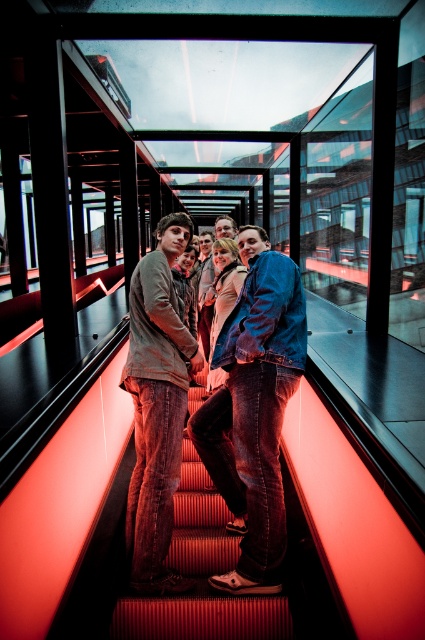
You are standing on the red steps of the escalator in the modern building with glass walls. You notice a point marked at coordinates (x=156, y=404). What object is located at that point?

The point at coordinates (x=156, y=404) has a matte gray hoodie at center.

You are a photographer trying to capture a detailed shot of the denim jacket at center and the smooth red carpet at center. Which object should you focus on first if you want to ensure both are in focus without adjusting the camera settings?

The denim jacket at center is taller than the smooth red carpet at center, so focusing on the denim jacket at center first would help ensure both are in focus since it is closer to the camera.